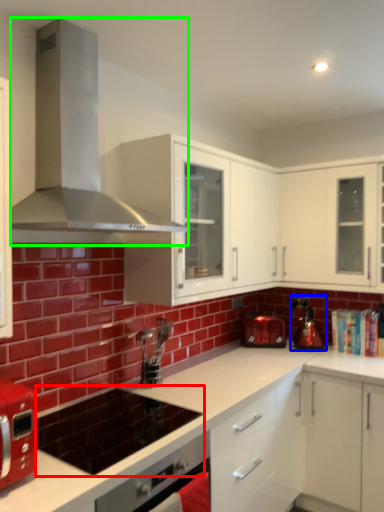
Question: Which object is the farthest from appliance (highlighted by a red box)? Choose among these: kitchen appliance (highlighted by a blue box) or home appliance (highlighted by a green box).

Choices:
 (A) kitchen appliance
 (B) home appliance

Answer: (A)